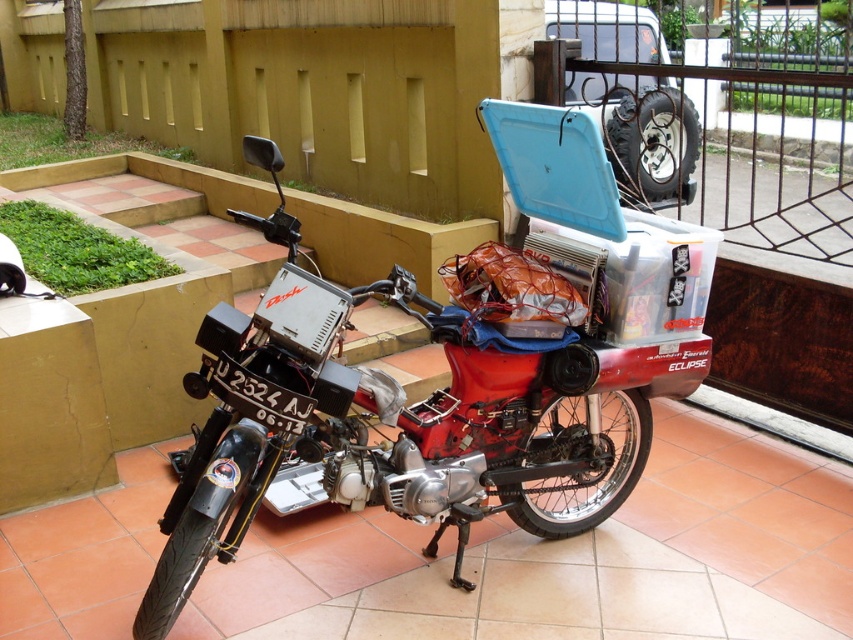
What do you see at coordinates (412, 404) in the screenshot?
I see `red matte motorcycle at center` at bounding box center [412, 404].

Can you confirm if red matte motorcycle at center is positioned below black metal fence at upper right?

Correct, red matte motorcycle at center is located below black metal fence at upper right.

Identify the location of red matte motorcycle at center. (412, 404).